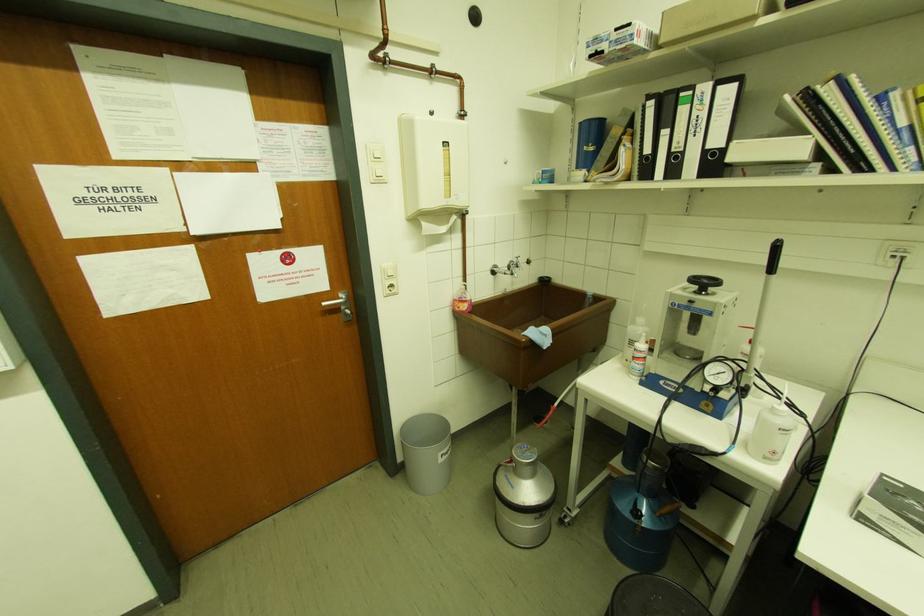
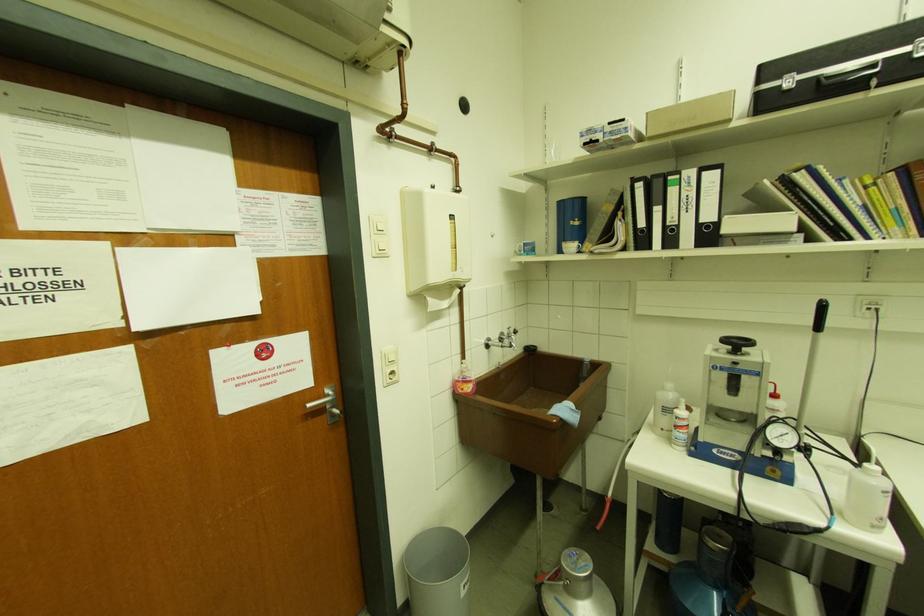
Question: The camera is either moving clockwise (left) or counter-clockwise (right) around the object. The first image is from the beginning of the video and the second image is from the end. Is the camera moving left or right when shooting the video?

Choices:
 (A) Left
 (B) Right

Answer: (A)